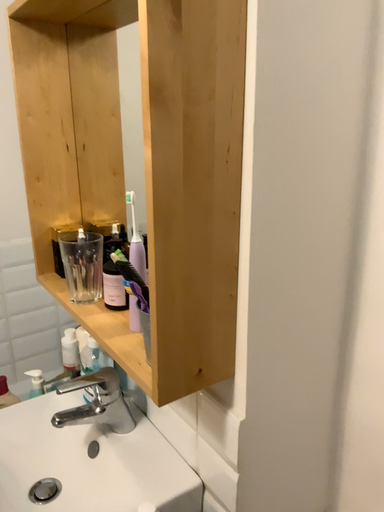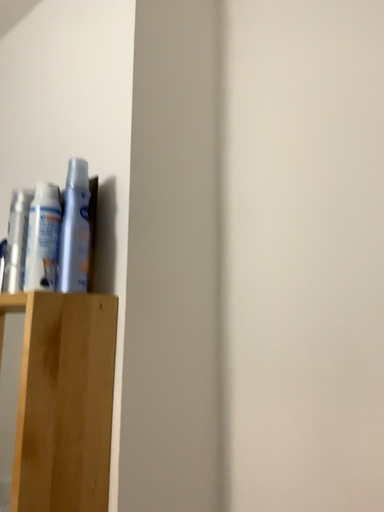
Question: Which way did the camera rotate in the video?

Choices:
 (A) rotated right
 (B) rotated left

Answer: (A)